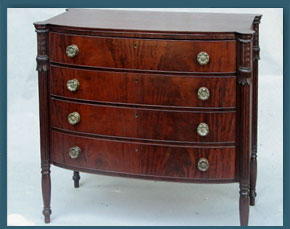
The image size is (290, 229). In order to click on knobs in this screenshot , I will do `click(73, 50)`, `click(200, 57)`, `click(204, 94)`, `click(72, 85)`, `click(73, 116)`, `click(199, 129)`, `click(204, 164)`, `click(71, 151)`.